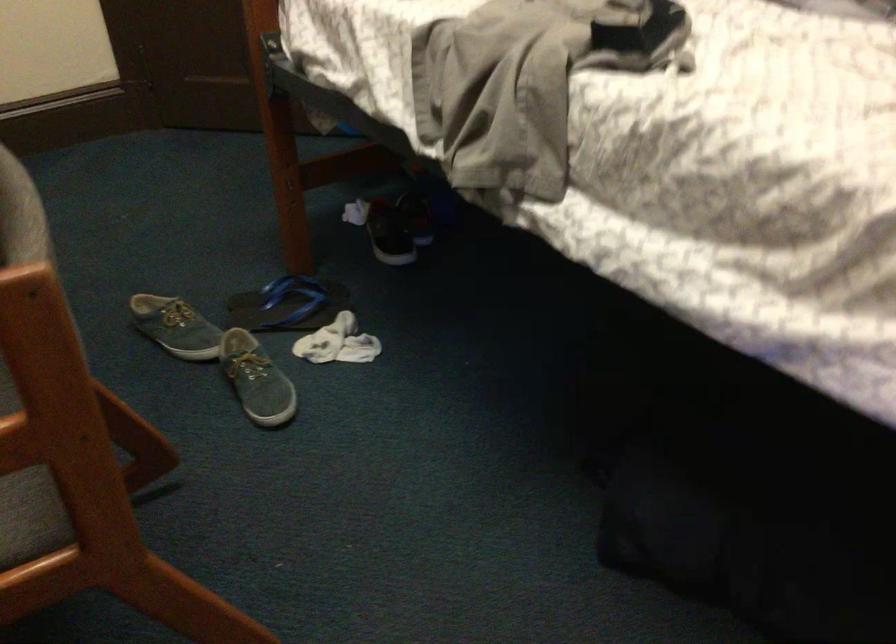
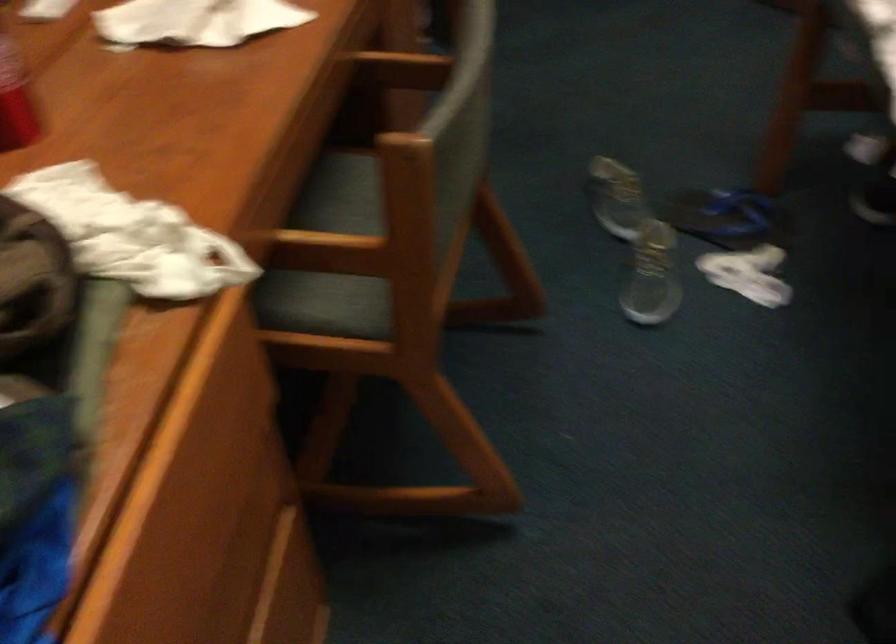
Locate, in the second image, the point that corresponds to pixel 290 305 in the first image.

(728, 218)